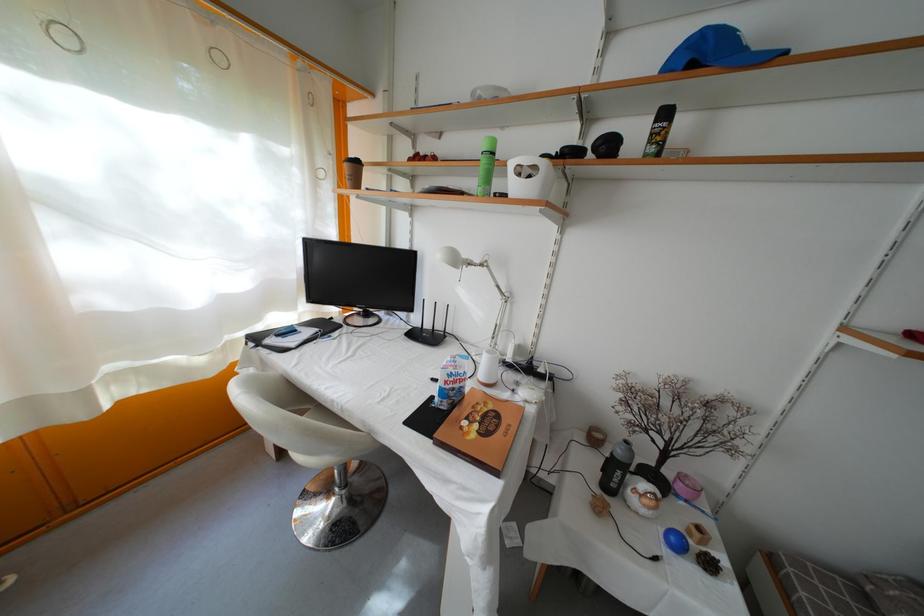
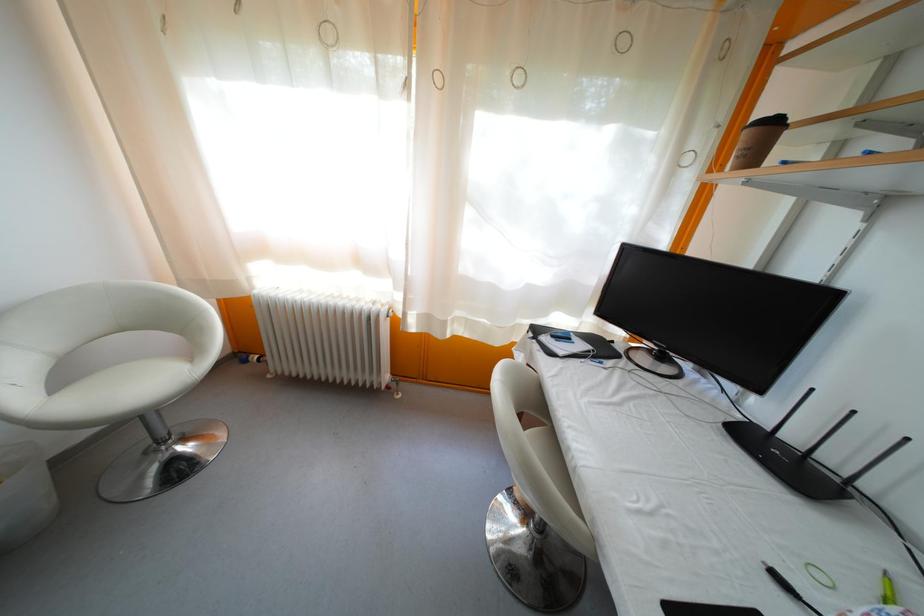
Question: The camera is either moving clockwise (left) or counter-clockwise (right) around the object. The first image is from the beginning of the video and the second image is from the end. Is the camera moving left or right when shooting the video?

Choices:
 (A) Left
 (B) Right

Answer: (B)